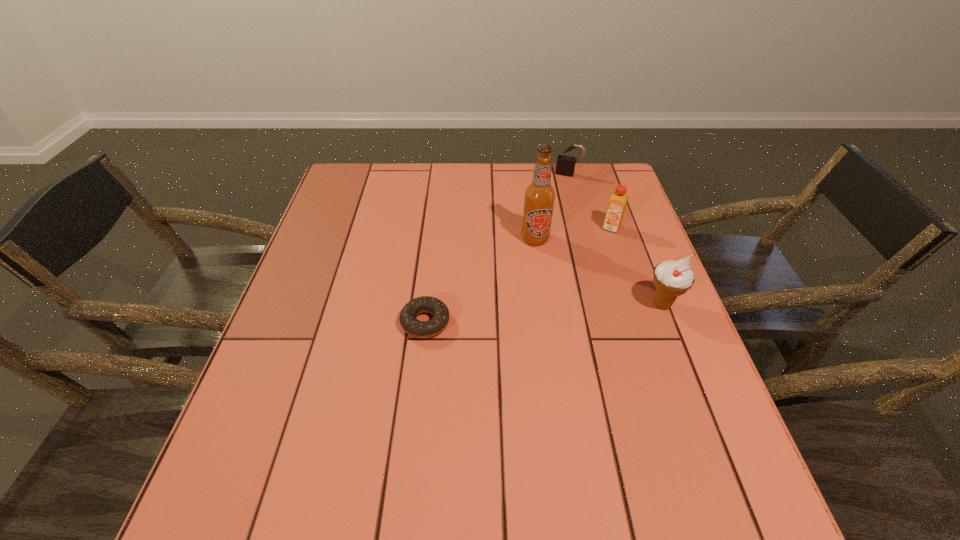
The width and height of the screenshot is (960, 540). In the image, there is a desktop. In order to click on vacant space at the far right corner in this screenshot , I will do `click(586, 198)`.

Image resolution: width=960 pixels, height=540 pixels. I want to click on free point at the near right corner, so [x=662, y=433].

At what (x,y) coordinates should I click in order to perform the action: click on vacant space that's between the orange juice and the tallest object. Please return your answer as a coordinate pair (x, y). Looking at the image, I should click on (573, 233).

Find the location of a particular element. The height and width of the screenshot is (540, 960). vacant region between the icecream and the tallest object is located at coordinates (598, 272).

This screenshot has width=960, height=540. Identify the location of free space between the icecream and the beer bottle. (598, 272).

You are a GUI agent. You are given a task and a screenshot of the screen. Output one action in this format:
    pyautogui.click(x=<x>, y=<y>)
    Task: Click on the free spot between the tallest object and the leftmost object
    This screenshot has height=540, width=960.
    Given the screenshot: What is the action you would take?
    pyautogui.click(x=480, y=281)

Identify the location of free space between the tallest object and the third tallest object. tap(573, 233).

Where is `empty space that is in between the icecream and the second shortest object`? empty space that is in between the icecream and the second shortest object is located at coordinates (615, 239).

The image size is (960, 540). I want to click on empty location between the orange juice and the second shortest object, so click(x=589, y=201).

Locate an element on the screen. The width and height of the screenshot is (960, 540). empty space between the icecream and the third shortest object is located at coordinates (636, 266).